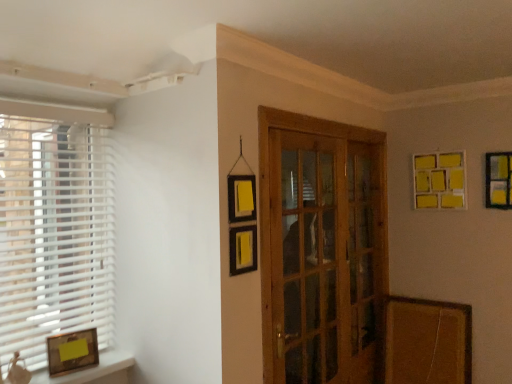
Question: From a real-world perspective, is yellow matte picture frame at upper right, which is the third picture frame from front to back, below yellow matte picture frame at upper right, placed as the 3th picture frame when sorted from left to right?

Choices:
 (A) no
 (B) yes

Answer: (A)

Question: Is yellow matte picture frame at upper right, which appears as the first picture frame when viewed from the back, facing away from yellow matte picture frame at upper right, placed as the 3th picture frame when sorted from left to right?

Choices:
 (A) yes
 (B) no

Answer: (B)

Question: Is yellow matte picture frame at upper right, positioned as the 2th picture frame in left-to-right order, in front of yellow matte picture frame at upper right, which ranks as the first picture frame in right-to-left order?

Choices:
 (A) yes
 (B) no

Answer: (B)

Question: From a real-world perspective, is yellow matte picture frame at upper right, which appears as the first picture frame when viewed from the back, over yellow matte picture frame at upper right, marked as the 2th picture frame in a bottom-to-top arrangement?

Choices:
 (A) yes
 (B) no

Answer: (A)

Question: Can you confirm if yellow matte picture frame at upper right, which is the third picture frame from front to back, is shorter than yellow matte picture frame at upper right, acting as the 2th picture frame starting from the top?

Choices:
 (A) no
 (B) yes

Answer: (A)

Question: Would you consider yellow matte picture frame at upper right, which appears as the first picture frame when viewed from the back, to be distant from yellow matte picture frame at upper right, the 2th picture frame when ordered from back to front?

Choices:
 (A) yes
 (B) no

Answer: (B)

Question: Is white plastic blinds at left in contact with matte gold picture frame at lower left, arranged as the 3th picture frame when viewed from the back?

Choices:
 (A) yes
 (B) no

Answer: (B)

Question: Considering the relative positions of white plastic blinds at left and matte gold picture frame at lower left, positioned as the first picture frame in left-to-right order, in the image provided, is white plastic blinds at left to the left of matte gold picture frame at lower left, positioned as the first picture frame in left-to-right order, from the viewer's perspective?

Choices:
 (A) no
 (B) yes

Answer: (B)

Question: Are white plastic blinds at left and matte gold picture frame at lower left, arranged as the 3th picture frame when viewed from the back, far apart?

Choices:
 (A) no
 (B) yes

Answer: (A)

Question: Does white plastic blinds at left have a lesser height compared to matte gold picture frame at lower left, arranged as the third picture frame when viewed from the top?

Choices:
 (A) yes
 (B) no

Answer: (B)

Question: Is white plastic blinds at left taller than matte gold picture frame at lower left, arranged as the third picture frame when viewed from the top?

Choices:
 (A) yes
 (B) no

Answer: (A)

Question: Is white plastic blinds at left wider than matte gold picture frame at lower left, the 1th picture frame in the front-to-back sequence?

Choices:
 (A) no
 (B) yes

Answer: (A)

Question: Can you confirm if yellow matte picture frame at upper right, positioned as the 2th picture frame in left-to-right order, is bigger than wooden glass door at center?

Choices:
 (A) yes
 (B) no

Answer: (B)